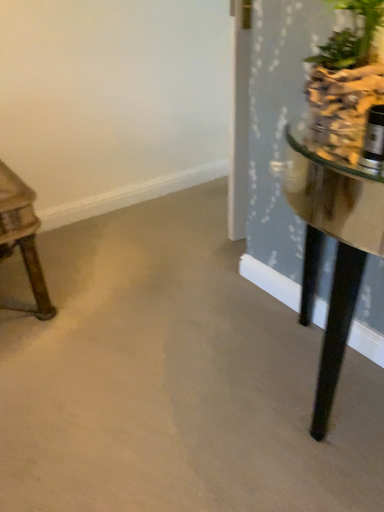
You are a GUI agent. You are given a task and a screenshot of the screen. Output one action in this format:
    pyautogui.click(x=<x>, y=<y>)
    Task: Click on the green leafy plant at upper right
    
    Given the screenshot: What is the action you would take?
    pyautogui.click(x=349, y=86)

Find the location of `wooden table at left`. wooden table at left is located at coordinates (22, 237).

From a real-world perspective, is green leafy plant at upper right above or below wooden table at left?

green leafy plant at upper right is above wooden table at left.

Can you confirm if green leafy plant at upper right is smaller than wooden table at left?

Correct, green leafy plant at upper right occupies less space than wooden table at left.

Is green leafy plant at upper right behind wooden table at left?

No, the depth of green leafy plant at upper right is less than that of wooden table at left.

Is wooden table at left aimed at smooth concrete floor at center?

No, wooden table at left is not turned towards smooth concrete floor at center.

From the image's perspective, which is above, wooden table at left or smooth concrete floor at center?

wooden table at left appears higher in the image.

Between wooden table at left and smooth concrete floor at center, which one has larger width?

wooden table at left is wider.

Can you confirm if wooden table at left is shorter than smooth concrete floor at center?

Yes, wooden table at left is shorter than smooth concrete floor at center.

Is wooden table at left in front of or behind green leafy plant at upper right in the image?

In the image, wooden table at left appears behind green leafy plant at upper right.

Based on the photo, between wooden table at left and green leafy plant at upper right, which one has smaller width?

green leafy plant at upper right.

Is point (28, 259) closer to viewer compared to point (381, 11)?

No.

Which object is positioned more to the left, wooden table at left or green leafy plant at upper right?

wooden table at left.

From the picture: How different are the orientations of smooth concrete floor at center and green leafy plant at upper right in degrees?

The facing directions of smooth concrete floor at center and green leafy plant at upper right are 2.55 degrees apart.

Could you tell me if smooth concrete floor at center is facing green leafy plant at upper right?

No.

Can green leafy plant at upper right be found inside smooth concrete floor at center?

No, green leafy plant at upper right is located outside of smooth concrete floor at center.

How many degrees apart are the facing directions of smooth concrete floor at center and wooden table at left?

smooth concrete floor at center and wooden table at left are facing 90.9 degrees away from each other.

Does smooth concrete floor at center appear on the right side of wooden table at left?

Yes.

In the scene shown: From a real-world perspective, is smooth concrete floor at center on top of wooden table at left?

Yes.

What's the angular difference between green leafy plant at upper right and smooth concrete floor at center's facing directions?

The angular difference between green leafy plant at upper right and smooth concrete floor at center is 2.55 degrees.

In the scene shown: Considering the relative sizes of green leafy plant at upper right and smooth concrete floor at center in the image provided, is green leafy plant at upper right wider than smooth concrete floor at center?

No.

Based on the photo, how much distance is there between green leafy plant at upper right and smooth concrete floor at center?

The distance of green leafy plant at upper right from smooth concrete floor at center is 34.00 inches.

From the image's perspective, relative to smooth concrete floor at center, is green leafy plant at upper right above or below?

Based on their image positions, green leafy plant at upper right is located above smooth concrete floor at center.

Locate an element on the screen. The width and height of the screenshot is (384, 512). houseplant in front of the wooden table at left is located at coordinates (349, 86).

Locate an element on the screen. Image resolution: width=384 pixels, height=512 pixels. concrete on the right of wooden table at left is located at coordinates click(175, 379).

Looking at the image, which one is located further to smooth concrete floor at center, wooden table at left or green leafy plant at upper right?

green leafy plant at upper right is further to smooth concrete floor at center.

Considering their positions, is smooth concrete floor at center positioned closer to green leafy plant at upper right than wooden table at left?

Based on the image, smooth concrete floor at center appears to be nearer to green leafy plant at upper right.

From the image, which object appears to be nearer to green leafy plant at upper right, wooden table at left or smooth concrete floor at center?

smooth concrete floor at center.

When comparing their distances from wooden table at left, does smooth concrete floor at center or green leafy plant at upper right seem closer?

smooth concrete floor at center lies closer to wooden table at left than the other object.

Considering their positions, is green leafy plant at upper right positioned further to smooth concrete floor at center than wooden table at left?

Based on the image, green leafy plant at upper right appears to be further to smooth concrete floor at center.

Based on their spatial positions, is green leafy plant at upper right or smooth concrete floor at center further from wooden table at left?

green leafy plant at upper right is positioned further to the anchor wooden table at left.

The image size is (384, 512). I want to click on houseplant between wooden table at left and smooth concrete floor at center from left to right, so click(349, 86).